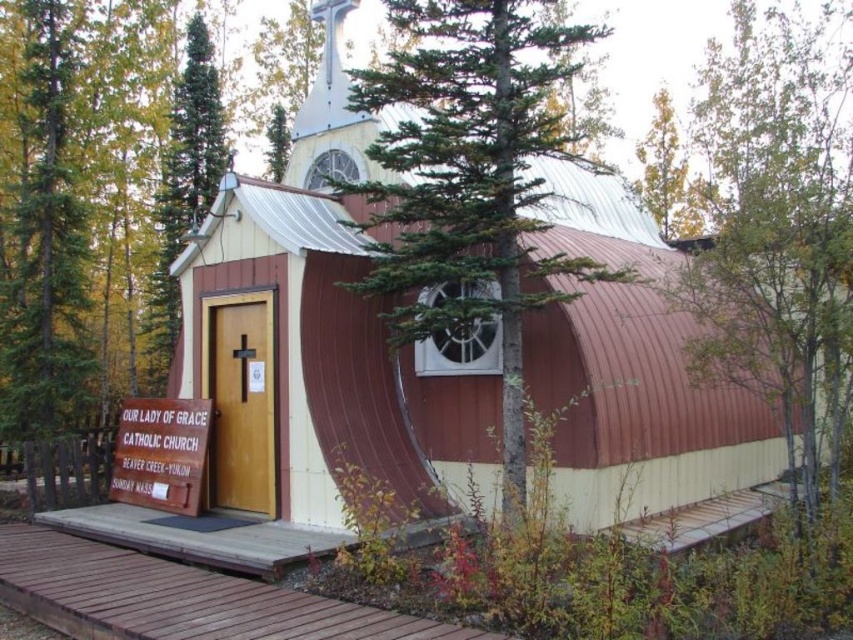
Is green leafy tree at center further to the viewer compared to green textured pine tree at upper center?

No, green leafy tree at center is in front of green textured pine tree at upper center.

How distant is green leafy tree at center from green textured pine tree at upper center?

They are 11.50 meters apart.

Is point (424, 264) closer to viewer compared to point (279, 145)?

Yes, point (424, 264) is in front of point (279, 145).

Locate an element on the screen. The width and height of the screenshot is (853, 640). green leafy tree at center is located at coordinates (471, 180).

Can you confirm if brown wooden walkway at lower center is positioned to the left of white wooden sign at center?

Incorrect, brown wooden walkway at lower center is not on the left side of white wooden sign at center.

Locate an element on the screen. This screenshot has height=640, width=853. brown wooden walkway at lower center is located at coordinates (177, 596).

Where is `brown wooden walkway at lower center`? Image resolution: width=853 pixels, height=640 pixels. brown wooden walkway at lower center is located at coordinates (177, 596).

Can you confirm if white wooden sign at center is thinner than green textured pine tree at upper center?

No.

Between point (173, 438) and point (270, 154), which one is positioned behind?

The point (270, 154) is more distant.

Locate an element on the screen. The image size is (853, 640). white wooden sign at center is located at coordinates coord(161,452).